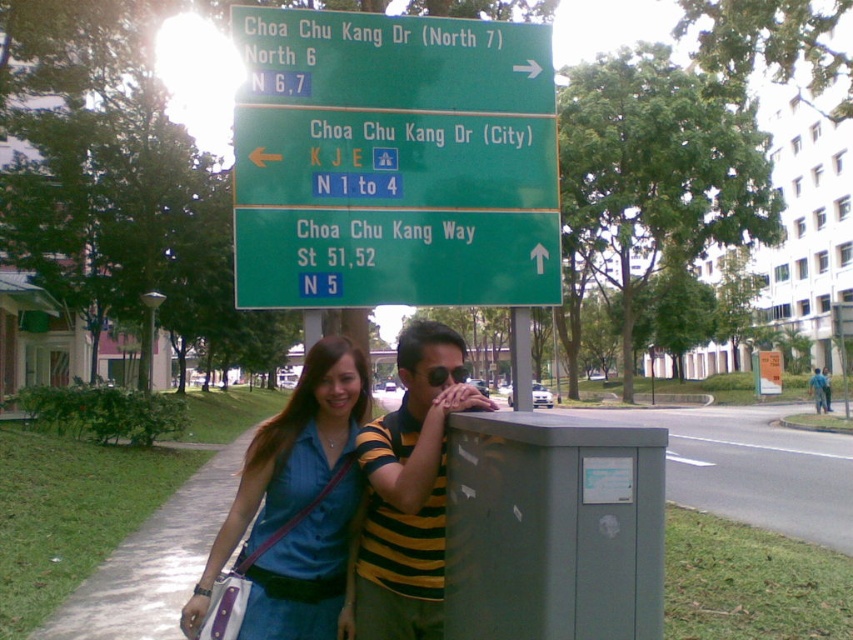
Can you confirm if green matte sign at center is smaller than green matte sign at upper center?

Incorrect, green matte sign at center is not smaller in size than green matte sign at upper center.

Does point (505, 266) lie behind point (247, 122)?

Yes, it is.

The height and width of the screenshot is (640, 853). Identify the location of green matte sign at center. (393, 257).

Is point (393, 113) more distant than point (547, 106)?

That is False.

The image size is (853, 640). What do you see at coordinates (393, 160) in the screenshot?
I see `green matte sign at upper center` at bounding box center [393, 160].

Does point (360, 134) come behind point (444, 99)?

No, it is in front of (444, 99).

Find the location of a particular element. This screenshot has height=640, width=853. green matte sign at upper center is located at coordinates [x=393, y=160].

Does point (561, 412) lie in front of point (811, 394)?

No, it is behind (811, 394).

Who is more forward, (724,497) or (820,385)?

Positioned in front is point (724,497).

This screenshot has width=853, height=640. In order to click on gray concrete pavement at lower center in this screenshot , I will do `click(753, 468)`.